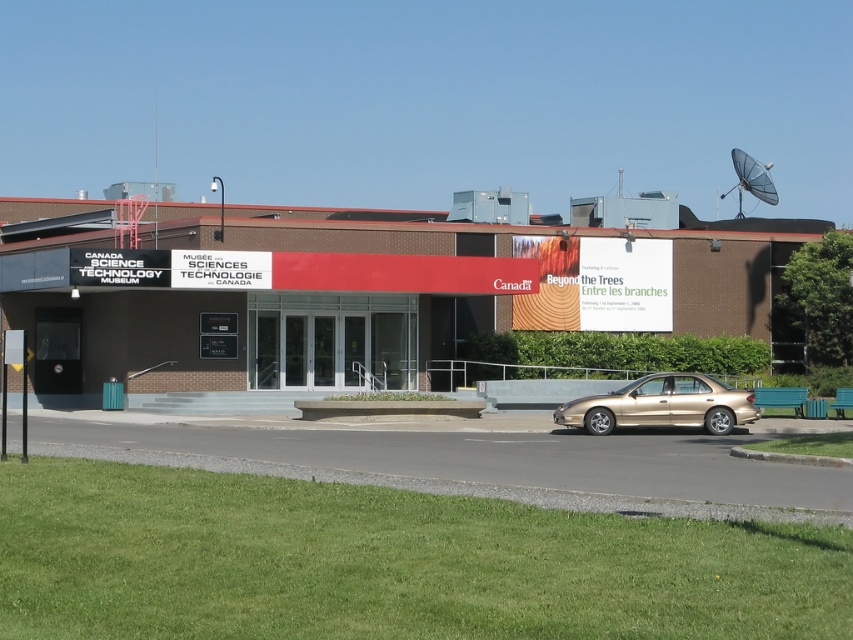
Does matte black building at center lie in front of gold metallic sedan at lower right?

No.

Can you confirm if matte black building at center is positioned to the right of gold metallic sedan at lower right?

No, matte black building at center is not to the right of gold metallic sedan at lower right.

You are a GUI agent. You are given a task and a screenshot of the screen. Output one action in this format:
    pyautogui.click(x=<x>, y=<y>)
    Task: Click on the matte black building at center
    The width and height of the screenshot is (853, 640).
    Given the screenshot: What is the action you would take?
    pyautogui.click(x=352, y=291)

Identify the location of matte black building at center. This screenshot has height=640, width=853. (352, 291).